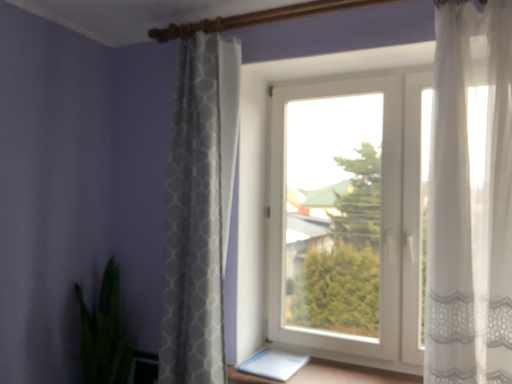
Where is `sheer white curtain at right, which is the first curtain in front-to-back order`? sheer white curtain at right, which is the first curtain in front-to-back order is located at coordinates (470, 201).

The height and width of the screenshot is (384, 512). What do you see at coordinates (352, 215) in the screenshot?
I see `white plastic window at center` at bounding box center [352, 215].

Locate an element on the screen. white textured curtain at center, placed as the 2th curtain when sorted from front to back is located at coordinates (199, 209).

Image resolution: width=512 pixels, height=384 pixels. Describe the element at coordinates (104, 334) in the screenshot. I see `green leafy plant at lower left` at that location.

At what (x,y) coordinates should I click in order to perform the action: click on sheer white curtain at right, which ranks as the 2th curtain in left-to-right order. Please return your answer as a coordinate pair (x, y). The image size is (512, 384). Looking at the image, I should click on (470, 201).

Would you say white plastic window at center is outside sheer white curtain at right, placed as the second curtain when sorted from back to front?

Indeed, white plastic window at center is completely outside sheer white curtain at right, placed as the second curtain when sorted from back to front.

Is white plastic window at center oriented towards sheer white curtain at right, acting as the 1th curtain starting from the right?

Yes, white plastic window at center faces towards sheer white curtain at right, acting as the 1th curtain starting from the right.

Based on their sizes in the image, would you say white plastic window at center is bigger or smaller than sheer white curtain at right, which is the first curtain in front-to-back order?

Clearly, white plastic window at center is larger in size than sheer white curtain at right, which is the first curtain in front-to-back order.

Is white plastic window at center to the left or to the right of sheer white curtain at right, which ranks as the 2th curtain in left-to-right order, in the image?

white plastic window at center is to the left of sheer white curtain at right, which ranks as the 2th curtain in left-to-right order.

Considering the sizes of objects green leafy plant at lower left and white textured curtain at center, which is the second curtain in right-to-left order, in the image provided, who is smaller, green leafy plant at lower left or white textured curtain at center, which is the second curtain in right-to-left order,?

With smaller size is green leafy plant at lower left.

How different are the orientations of green leafy plant at lower left and white textured curtain at center, which ranks as the first curtain in back-to-front order, in degrees?

They differ by 6.97 degrees in their facing directions.

Could you tell me if green leafy plant at lower left is turned towards white textured curtain at center, which is counted as the 1th curtain, starting from the left?

No, green leafy plant at lower left is not oriented towards white textured curtain at center, which is counted as the 1th curtain, starting from the left.

Which is in front, green leafy plant at lower left or white textured curtain at center, which is counted as the 1th curtain, starting from the left?

white textured curtain at center, which is counted as the 1th curtain, starting from the left, is more forward.

Does sheer white curtain at right, acting as the 1th curtain starting from the right, have a greater height compared to green leafy plant at lower left?

Yes.

Considering the sizes of objects sheer white curtain at right, which is the first curtain in front-to-back order, and green leafy plant at lower left in the image provided, who is smaller, sheer white curtain at right, which is the first curtain in front-to-back order, or green leafy plant at lower left?

sheer white curtain at right, which is the first curtain in front-to-back order.

Is sheer white curtain at right, which ranks as the 2th curtain in left-to-right order, next to green leafy plant at lower left?

No, sheer white curtain at right, which ranks as the 2th curtain in left-to-right order, is not next to green leafy plant at lower left.

Is sheer white curtain at right, acting as the 1th curtain starting from the right, in front of green leafy plant at lower left?

Yes, it is.

Is there a large distance between white textured curtain at center, placed as the 2th curtain when sorted from front to back, and white plastic window at center?

white textured curtain at center, placed as the 2th curtain when sorted from front to back, is actually quite close to white plastic window at center.

Is white textured curtain at center, which ranks as the first curtain in back-to-front order, inside or outside of white plastic window at center?

white textured curtain at center, which ranks as the first curtain in back-to-front order, is spatially situated outside white plastic window at center.

Considering the relative sizes of white textured curtain at center, which is the second curtain in right-to-left order, and white plastic window at center in the image provided, is white textured curtain at center, which is the second curtain in right-to-left order, thinner than white plastic window at center?

No.

Is point (203, 365) closer to camera compared to point (297, 287)?

Yes, it is in front of point (297, 287).

Is sheer white curtain at right, which is the first curtain in front-to-back order, not inside white textured curtain at center, placed as the 2th curtain when sorted from front to back?

Yes, sheer white curtain at right, which is the first curtain in front-to-back order, is not within white textured curtain at center, placed as the 2th curtain when sorted from front to back.

From the picture: Is sheer white curtain at right, placed as the second curtain when sorted from back to front, facing away from white textured curtain at center, which is counted as the 1th curtain, starting from the left?

No, sheer white curtain at right, placed as the second curtain when sorted from back to front, is not facing the opposite direction of white textured curtain at center, which is counted as the 1th curtain, starting from the left.

How many degrees apart are the facing directions of sheer white curtain at right, acting as the 1th curtain starting from the right, and white textured curtain at center, which is counted as the 1th curtain, starting from the left?

The angular difference between sheer white curtain at right, acting as the 1th curtain starting from the right, and white textured curtain at center, which is counted as the 1th curtain, starting from the left, is 0.00254 degrees.

The height and width of the screenshot is (384, 512). Find the location of `curtain below the sheer white curtain at right, acting as the 1th curtain starting from the right (from the image's perspective)`. curtain below the sheer white curtain at right, acting as the 1th curtain starting from the right (from the image's perspective) is located at coordinates (199, 209).

From a real-world perspective, is white plastic window at center above or below green leafy plant at lower left?

white plastic window at center is above green leafy plant at lower left.

Who is more distant, white plastic window at center or green leafy plant at lower left?

green leafy plant at lower left is further from the camera.

Does point (118, 350) appear closer or farther from the camera than point (452, 81)?

Point (118, 350).

Relative to sheer white curtain at right, acting as the 1th curtain starting from the right, is green leafy plant at lower left in front or behind?

In the image, green leafy plant at lower left appears behind sheer white curtain at right, acting as the 1th curtain starting from the right.

Starting from the green leafy plant at lower left, which curtain is the 2nd one in front? Please provide its 2D coordinates.

[(470, 201)]

Would you say green leafy plant at lower left is inside or outside sheer white curtain at right, which ranks as the 2th curtain in left-to-right order?

green leafy plant at lower left is not inside sheer white curtain at right, which ranks as the 2th curtain in left-to-right order, it's outside.

Where is `the 2nd curtain positioned above the white plastic window at center (from a real-world perspective)`? This screenshot has width=512, height=384. the 2nd curtain positioned above the white plastic window at center (from a real-world perspective) is located at coordinates (470, 201).

The image size is (512, 384). Identify the location of houseplant behind the white textured curtain at center, which ranks as the first curtain in back-to-front order. pos(104,334).

In the scene shown: From the image, which object appears to be farther from green leafy plant at lower left, white plastic window at center or sheer white curtain at right, placed as the second curtain when sorted from back to front?

sheer white curtain at right, placed as the second curtain when sorted from back to front, lies further to green leafy plant at lower left than the other object.

Based on their spatial positions, is green leafy plant at lower left or sheer white curtain at right, which is the first curtain in front-to-back order, closer to white plastic window at center?

Among the two, sheer white curtain at right, which is the first curtain in front-to-back order, is located nearer to white plastic window at center.

When comparing their distances from green leafy plant at lower left, does white textured curtain at center, which is the second curtain in right-to-left order, or sheer white curtain at right, which ranks as the 2th curtain in left-to-right order, seem closer?

white textured curtain at center, which is the second curtain in right-to-left order, is positioned closer to the anchor green leafy plant at lower left.

Based on their spatial positions, is sheer white curtain at right, placed as the second curtain when sorted from back to front, or white plastic window at center further from white textured curtain at center, which is the second curtain in right-to-left order?

sheer white curtain at right, placed as the second curtain when sorted from back to front, is positioned further to the anchor white textured curtain at center, which is the second curtain in right-to-left order.

When comparing their distances from sheer white curtain at right, acting as the 1th curtain starting from the right, does white textured curtain at center, placed as the 2th curtain when sorted from front to back, or green leafy plant at lower left seem further?

green leafy plant at lower left lies further to sheer white curtain at right, acting as the 1th curtain starting from the right, than the other object.

When comparing their distances from white textured curtain at center, which ranks as the first curtain in back-to-front order, does green leafy plant at lower left or white plastic window at center seem closer?

Among the two, green leafy plant at lower left is located nearer to white textured curtain at center, which ranks as the first curtain in back-to-front order.

Looking at this image, considering their positions, is white textured curtain at center, which is counted as the 1th curtain, starting from the left, positioned further to sheer white curtain at right, acting as the 1th curtain starting from the right, than white plastic window at center?

white textured curtain at center, which is counted as the 1th curtain, starting from the left, lies further to sheer white curtain at right, acting as the 1th curtain starting from the right, than the other object.

When comparing their distances from sheer white curtain at right, placed as the second curtain when sorted from back to front, does green leafy plant at lower left or white textured curtain at center, which is the second curtain in right-to-left order, seem further?

The object further to sheer white curtain at right, placed as the second curtain when sorted from back to front, is green leafy plant at lower left.

In order to click on curtain between green leafy plant at lower left and white plastic window at center in the horizontal direction in this screenshot , I will do `click(199, 209)`.

What are the coordinates of `window between green leafy plant at lower left and sheer white curtain at right, placed as the second curtain when sorted from back to front, from left to right` in the screenshot? It's located at (352, 215).

Where is `curtain between green leafy plant at lower left and sheer white curtain at right, which is the first curtain in front-to-back order`? This screenshot has width=512, height=384. curtain between green leafy plant at lower left and sheer white curtain at right, which is the first curtain in front-to-back order is located at coordinates (199, 209).

This screenshot has height=384, width=512. In order to click on window between white textured curtain at center, which is counted as the 1th curtain, starting from the left, and sheer white curtain at right, which ranks as the 2th curtain in left-to-right order, in the horizontal direction in this screenshot , I will do `click(352, 215)`.